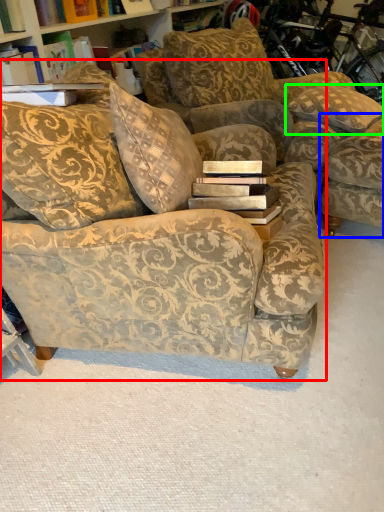
Question: Which object is the farthest from studio couch (highlighted by a red box)? Choose among these: swivel chair (highlighted by a blue box) or pillow (highlighted by a green box).

Choices:
 (A) swivel chair
 (B) pillow

Answer: (B)